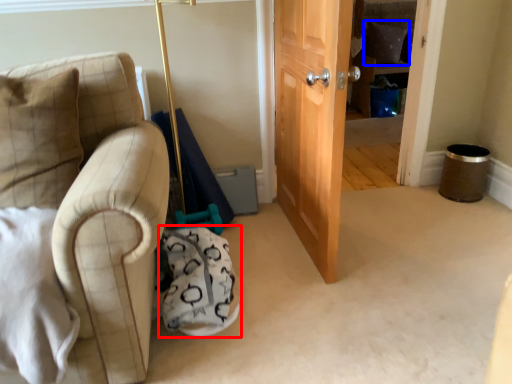
Question: Which object is further to the camera taking this photo, swivel chair (highlighted by a red box) or pillow (highlighted by a blue box)?

Choices:
 (A) swivel chair
 (B) pillow

Answer: (B)